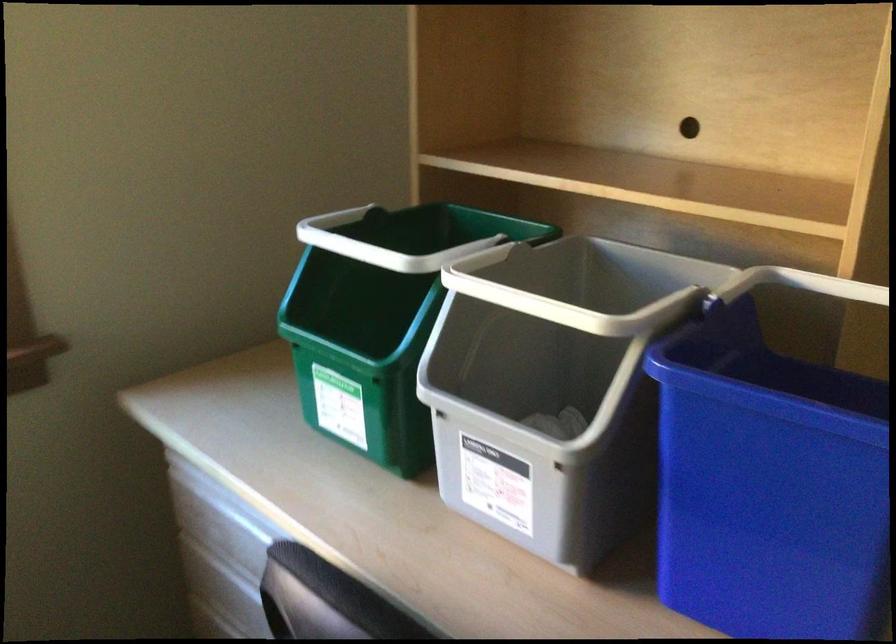
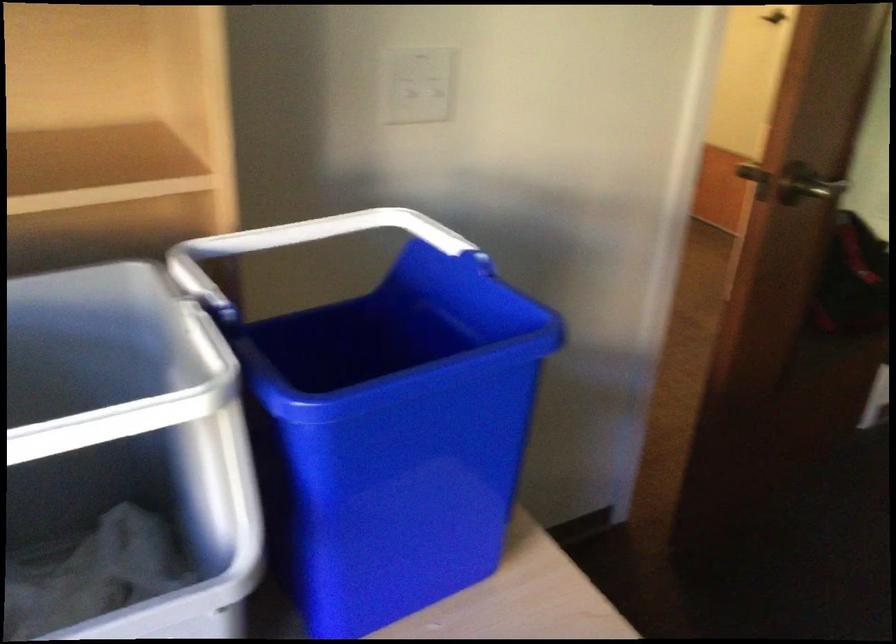
Find the pixel in the second image that matches (x=796, y=283) in the first image.

(213, 257)